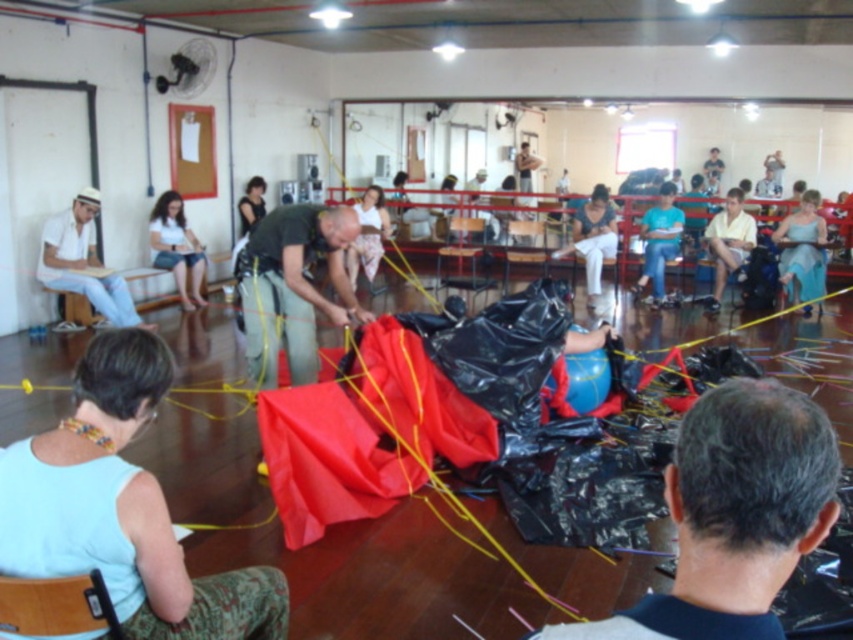
Who is shorter, light blue fabric at lower left or matte green shirt at center?

With less height is light blue fabric at lower left.

Is light blue fabric at lower left smaller than matte green shirt at center?

Indeed, light blue fabric at lower left has a smaller size compared to matte green shirt at center.

Find the location of a particular element. This screenshot has width=853, height=640. light blue fabric at lower left is located at coordinates (122, 508).

Does point (746, 244) come closer to viewer compared to point (531, 257)?

That is True.

Does point (740, 204) come behind point (543, 244)?

No, it is not.

Is point (721, 253) farther from camera compared to point (525, 253)?

That is False.

This screenshot has width=853, height=640. Find the location of `yellow cotton shirt at upper right`. yellow cotton shirt at upper right is located at coordinates (728, 241).

Does white matte shirt at left have a greater height compared to white fabric pants at center?

No.

Is white matte shirt at left positioned before white fabric pants at center?

Yes, white matte shirt at left is in front of white fabric pants at center.

What are the coordinates of `white matte shirt at left` in the screenshot? It's located at pos(83,262).